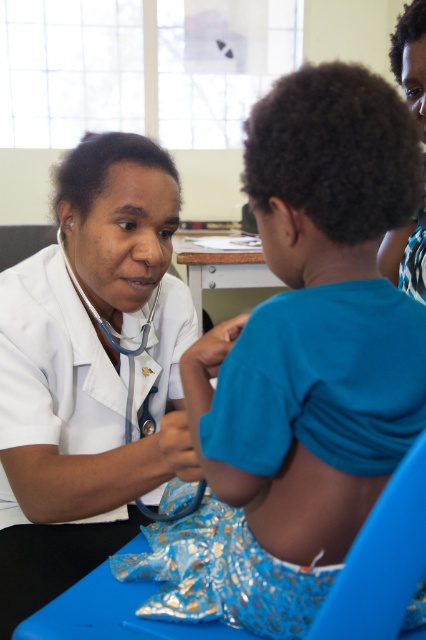
You are a medical student observing a nurse examining a child in the scene. The nurse is wearing a white coat. There is a point at coordinates point [411,58]. Where is this point located on the nurse?

The point [411,58] is located on the matte white coat at upper left of the nurse.

You are a medical student observing a nurse using the white smooth stethoscope at center during a pediatric examination. If the stethoscope is 34 inches away from you, can you comfortably reach it without moving your position? Assume your outstretched arm reaches 36 inches.

The white smooth stethoscope at center is 34.00 inches away from the viewer. Since your arm can reach 36 inches, you can comfortably reach it without moving.

Looking at this image, you are a medical student observing a nurse in a medical setting. You notice the matte white coat at upper left and the blue rubber stethoscope at left. Which object is narrower?

The matte white coat at upper left is narrower than the blue rubber stethoscope at left.